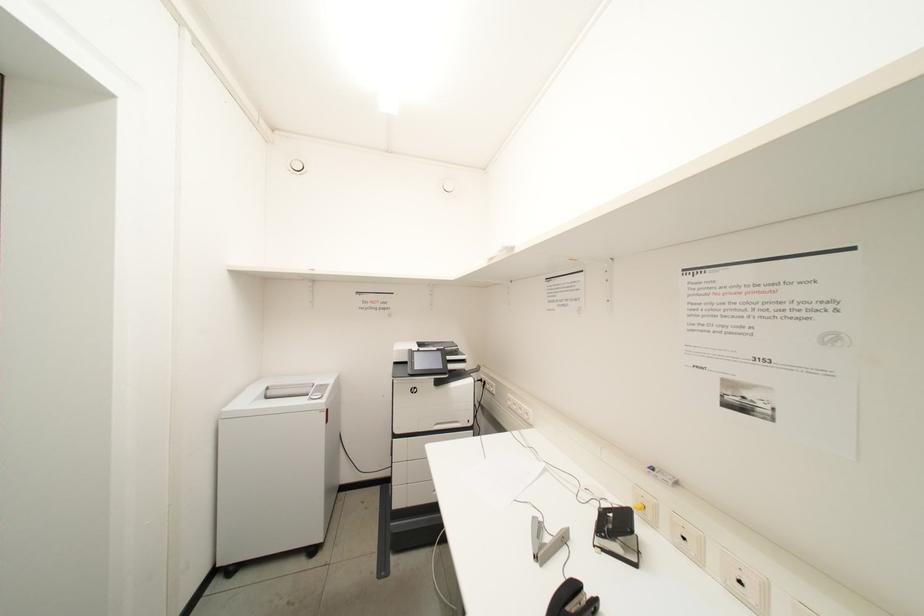
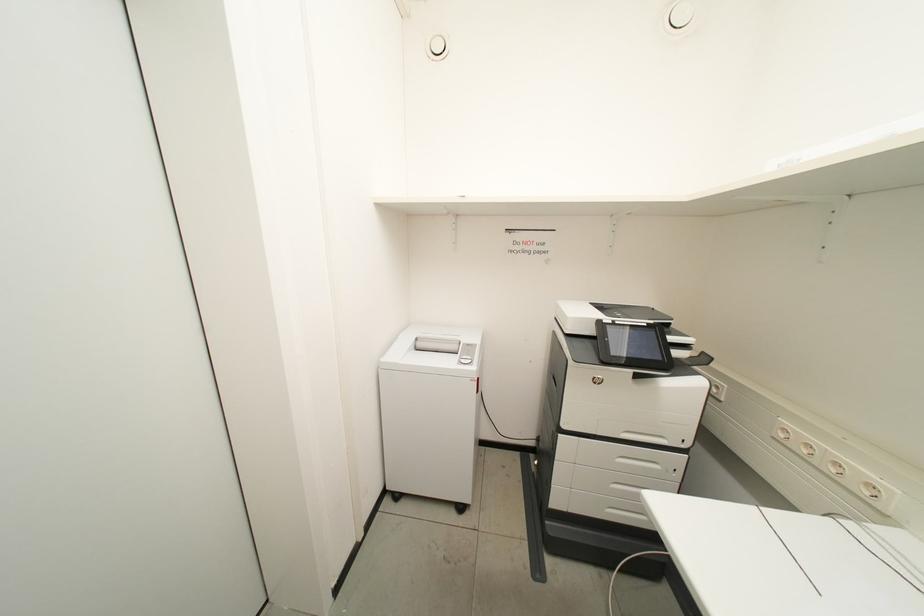
Question: The images are taken continuously from a first-person perspective. In which direction is your viewpoint rotating?

Choices:
 (A) Left
 (B) Right
 (C) Up
 (D) Down

Answer: (A)